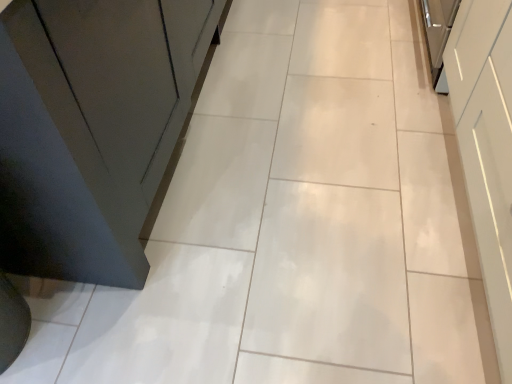
What is the approximate height of white glossy cabinet at right?

white glossy cabinet at right is 25.24 inches in height.

The image size is (512, 384). I want to click on white glossy cabinet at right, so click(487, 147).

The width and height of the screenshot is (512, 384). Describe the element at coordinates (487, 147) in the screenshot. I see `white glossy cabinet at right` at that location.

This screenshot has width=512, height=384. I want to click on white glossy drawer at upper right, so click(x=471, y=47).

What do you see at coordinates (471, 47) in the screenshot?
I see `white glossy drawer at upper right` at bounding box center [471, 47].

Where is `white glossy cabinet at right`? white glossy cabinet at right is located at coordinates (487, 147).

Which object is positioned more to the right, white glossy drawer at upper right or white glossy cabinet at right?

Positioned to the right is white glossy drawer at upper right.

Is white glossy drawer at upper right in front of white glossy cabinet at right?

No.

Which is nearer, (x=466, y=89) or (x=477, y=121)?

Point (x=466, y=89) is positioned farther from the camera compared to point (x=477, y=121).

From the image's perspective, is white glossy drawer at upper right located above or below white glossy cabinet at right?

Based on their image positions, white glossy drawer at upper right is located above white glossy cabinet at right.

From a real-world perspective, which object stands above the other?

white glossy cabinet at right is physically above.

Is white glossy drawer at upper right wider or thinner than white glossy cabinet at right?

In the image, white glossy drawer at upper right appears to be more narrow than white glossy cabinet at right.

Considering the sizes of objects white glossy drawer at upper right and white glossy cabinet at right in the image provided, who is taller, white glossy drawer at upper right or white glossy cabinet at right?

Standing taller between the two is white glossy cabinet at right.

Between white glossy drawer at upper right and white glossy cabinet at right, which one has larger size?

white glossy cabinet at right.

Can we say white glossy drawer at upper right lies outside white glossy cabinet at right?

Yes.

Would you consider white glossy drawer at upper right to be distant from white glossy cabinet at right?

No, there isn't a large distance between white glossy drawer at upper right and white glossy cabinet at right.

Is white glossy drawer at upper right oriented towards white glossy cabinet at right?

No, white glossy drawer at upper right is not turned towards white glossy cabinet at right.

What's the angular difference between white glossy drawer at upper right and white glossy cabinet at right's facing directions?

3.73e-05 degrees separate the facing orientations of white glossy drawer at upper right and white glossy cabinet at right.

The width and height of the screenshot is (512, 384). In order to click on drawer located on the right of white glossy cabinet at right in this screenshot , I will do `click(471, 47)`.

Between white glossy cabinet at right and white glossy drawer at upper right, which one appears on the right side from the viewer's perspective?

Positioned to the right is white glossy drawer at upper right.

Is white glossy cabinet at right behind white glossy drawer at upper right?

That is False.

Is point (504, 39) positioned in front of point (466, 26)?

Yes, point (504, 39) is closer to viewer.

From the image's perspective, relative to white glossy drawer at upper right, is white glossy cabinet at right above or below?

From the image's perspective, white glossy cabinet at right appears below white glossy drawer at upper right.

From a real-world perspective, who is located higher, white glossy cabinet at right or white glossy drawer at upper right?

white glossy cabinet at right.

Considering the sizes of objects white glossy cabinet at right and white glossy drawer at upper right in the image provided, who is wider, white glossy cabinet at right or white glossy drawer at upper right?

white glossy cabinet at right is wider.

Between white glossy cabinet at right and white glossy drawer at upper right, which one has less height?

Standing shorter between the two is white glossy drawer at upper right.

Does white glossy cabinet at right have a smaller size compared to white glossy drawer at upper right?

No.

Would you say white glossy cabinet at right contains white glossy drawer at upper right?

No, white glossy drawer at upper right is not surrounded by white glossy cabinet at right.

Is white glossy cabinet at right placed right next to white glossy drawer at upper right?

No, white glossy cabinet at right is not beside white glossy drawer at upper right.

Does white glossy cabinet at right turn towards white glossy drawer at upper right?

No, white glossy cabinet at right is not facing towards white glossy drawer at upper right.

At what (x,y) coordinates should I click in order to perform the action: click on cabinetry on the left of white glossy drawer at upper right. Please return your answer as a coordinate pair (x, y). This screenshot has height=384, width=512. Looking at the image, I should click on (487, 147).

Image resolution: width=512 pixels, height=384 pixels. In the image, there is a white glossy drawer at upper right. Find the location of `cabinetry below it (from the image's perspective)`. cabinetry below it (from the image's perspective) is located at coordinates (487, 147).

The image size is (512, 384). Find the location of `drawer to the right of white glossy cabinet at right`. drawer to the right of white glossy cabinet at right is located at coordinates (471, 47).